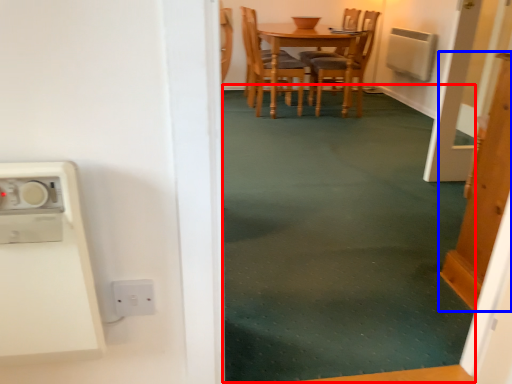
Question: Which object is closer to the camera taking this photo, plain (highlighted by a red box) or door (highlighted by a blue box)?

Choices:
 (A) plain
 (B) door

Answer: (B)